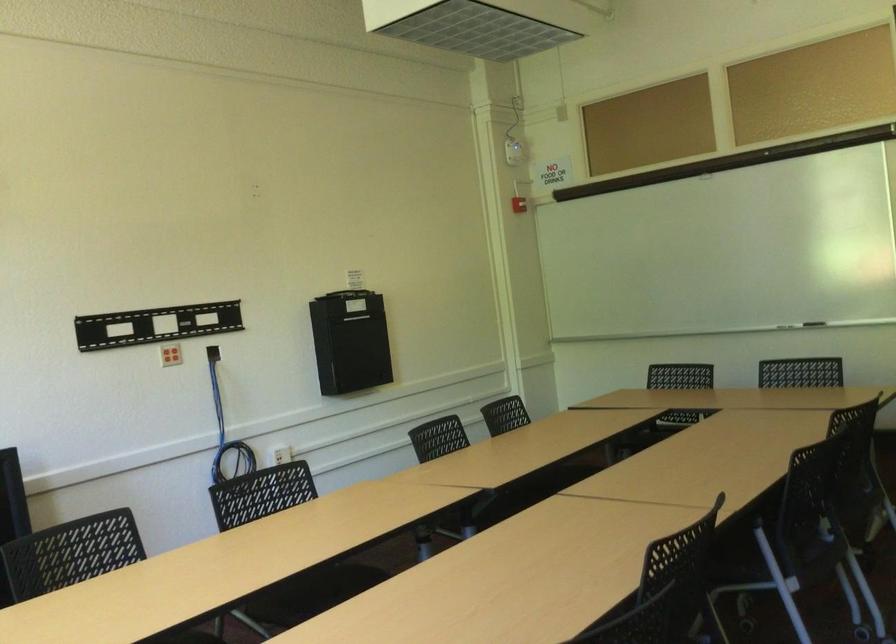
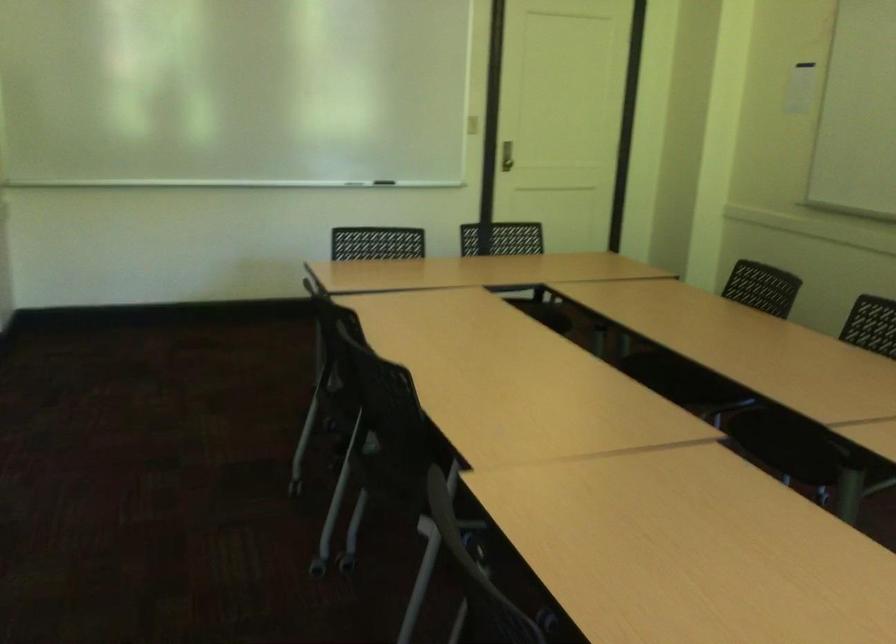
Question: I am providing you with two images of the same scene from different viewpoints. After the viewpoint changes to image2, which objects are now occluded?

Choices:
 (A) outdoor chair sitting surface
 (B) metal door handle
 (C) chair sitting surface
 (D) whiteboard eraser

Answer: (D)